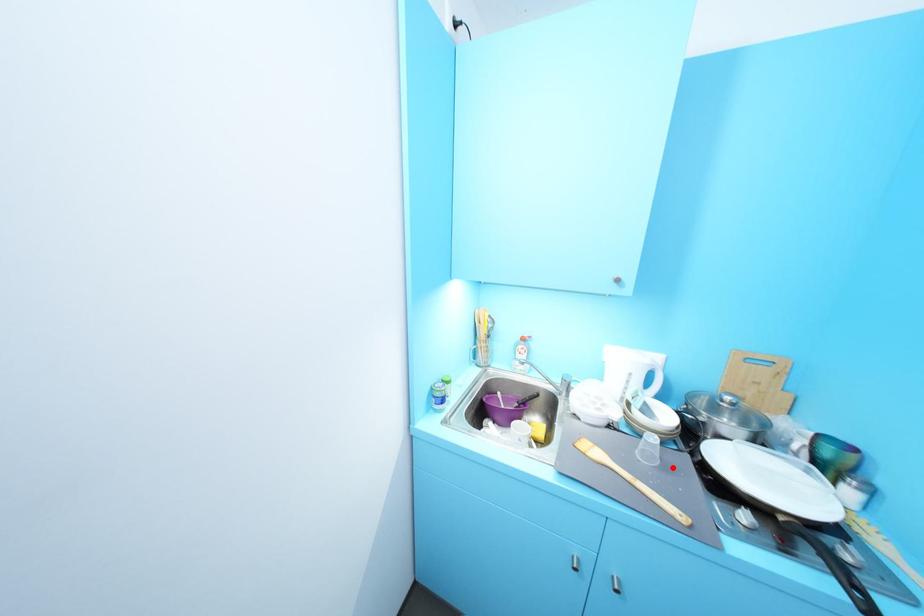
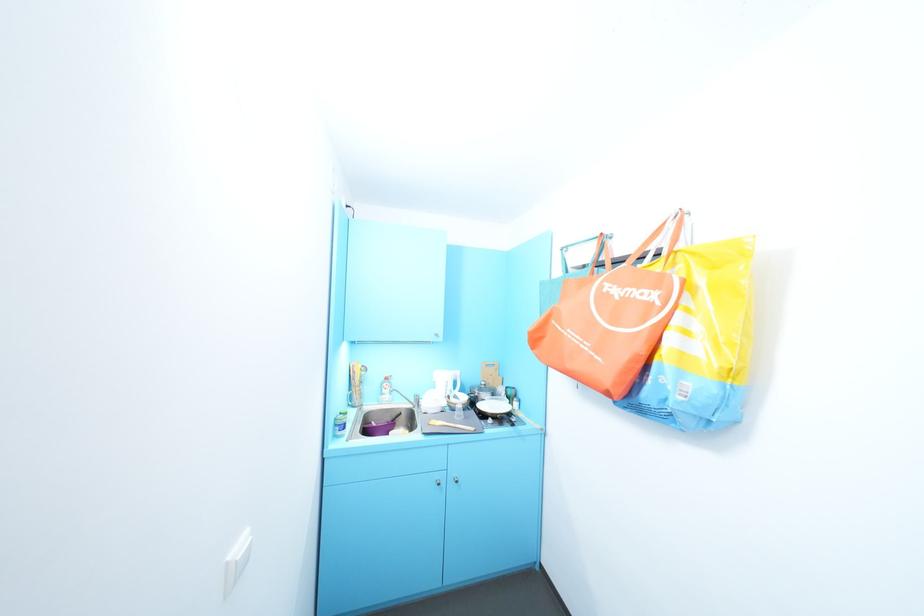
Find the pixel in the second image that matches the highlighted location in the first image.

(472, 418)